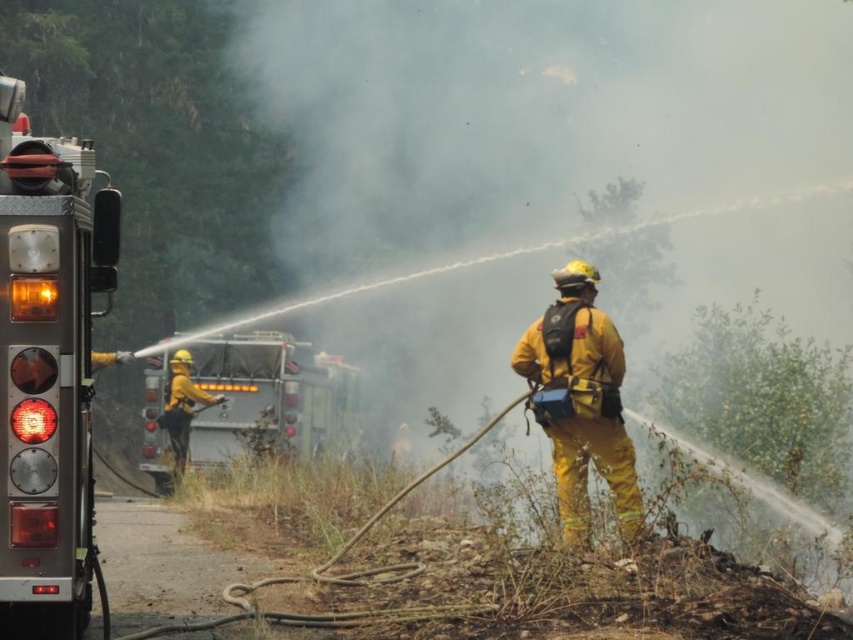
Question: Which point is farther to the camera?

Choices:
 (A) (192, 406)
 (B) (328, 365)

Answer: (B)

Question: Does metallic silver fire truck at left appear on the right side of yellow matte fireman at left?

Choices:
 (A) yes
 (B) no

Answer: (A)

Question: Which of the following is the closest to the observer?

Choices:
 (A) yellow matte fireman at left
 (B) yellow fireproof suit at center
 (C) metallic silver fire truck at left
 (D) brushed metal fire truck at center-left

Answer: (C)

Question: Estimate the real-world distances between objects in this image. Which object is farther from the yellow fireproof suit at center?

Choices:
 (A) yellow matte fireman at left
 (B) brushed metal fire truck at center-left
 (C) metallic silver fire truck at left

Answer: (B)

Question: From the image, what is the correct spatial relationship of brushed metal fire truck at center-left in relation to yellow fireproof suit at center?

Choices:
 (A) right
 (B) left

Answer: (B)

Question: Is metallic silver fire truck at left to the right of yellow matte fireman at left from the viewer's perspective?

Choices:
 (A) no
 (B) yes

Answer: (B)